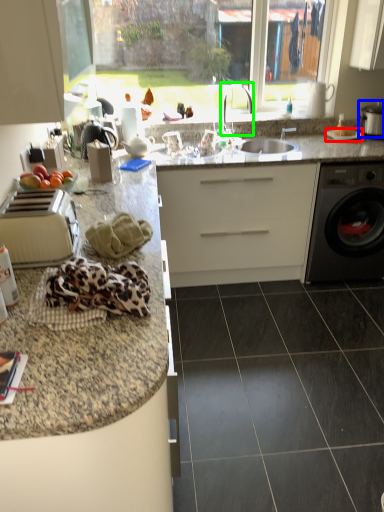
Question: Which is nearer to the gas stove (highlighted by a red box)? appliance (highlighted by a blue box) or faucet (highlighted by a green box).

Choices:
 (A) appliance
 (B) faucet

Answer: (A)